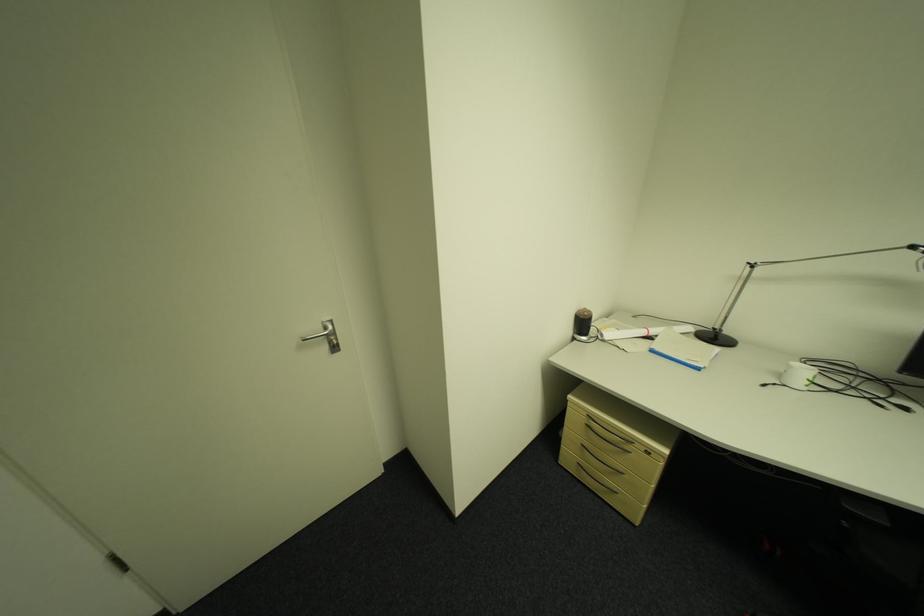
What do you see at coordinates (325, 336) in the screenshot?
I see `a metal door handle` at bounding box center [325, 336].